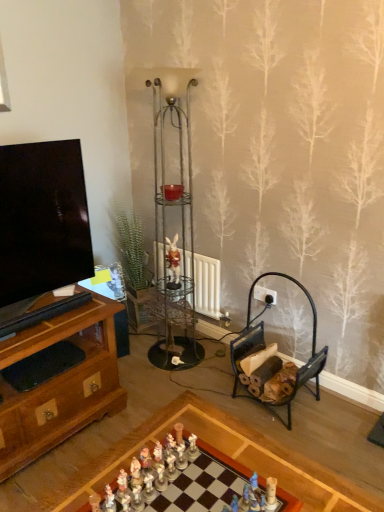
The image size is (384, 512). In order to click on free space behind white porcelain figurines at center, placed as the 1th toy when sorted from back to front in this screenshot , I will do `click(188, 422)`.